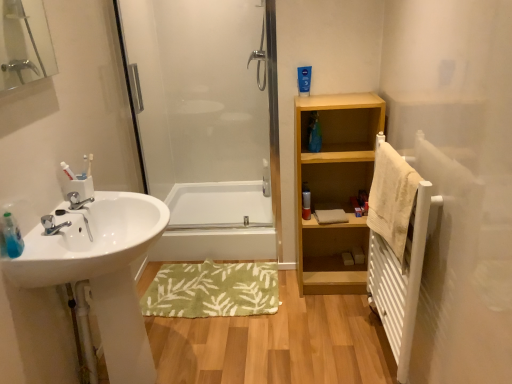
You are a GUI agent. You are given a task and a screenshot of the screen. Output one action in this format:
    pyautogui.click(x=<x>, y=<y>)
    Task: Click on the free space to the left of light wood shelf at center right
    
    Given the screenshot: What is the action you would take?
    pyautogui.click(x=290, y=290)